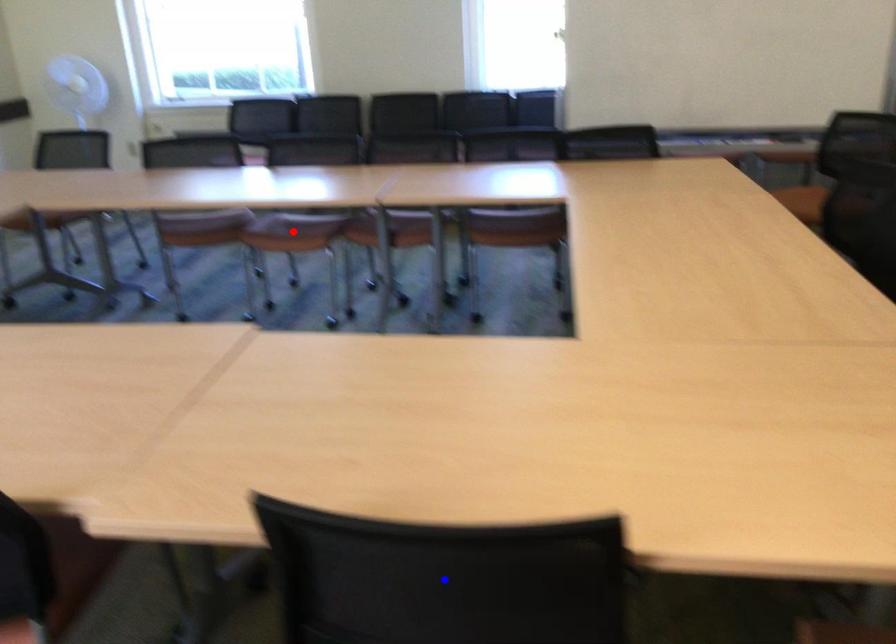
Question: Two points are marked on the image. Which point is closer to the camera?

Choices:
 (A) Blue point is closer.
 (B) Red point is closer.

Answer: (A)